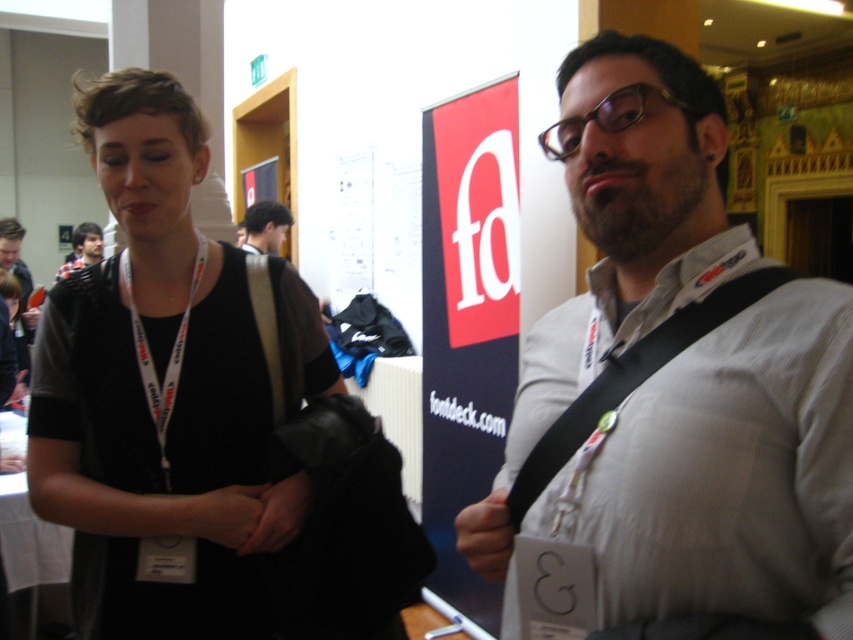
Question: Considering the real-world distances, which object is farthest from the dark blue shirt at upper left?

Choices:
 (A) white fabric lanyard at center
 (B) black matte vest at left
 (C) black fabric lanyard at center
 (D) dark brown hair at upper center

Answer: (C)

Question: Among these points, which one is farthest from the camera?

Choices:
 (A) (450, 173)
 (B) (241, 424)
 (C) (662, 506)
 (D) (254, 212)

Answer: (D)

Question: Which of the following is the farthest from the observer?

Choices:
 (A) (654, 515)
 (B) (183, 122)
 (C) (267, 214)

Answer: (C)

Question: Does black fabric lanyard at center have a smaller size compared to white fabric lanyard at center?

Choices:
 (A) yes
 (B) no

Answer: (B)

Question: Can you confirm if red fabric banner at center is thinner than dark brown hair at upper center?

Choices:
 (A) no
 (B) yes

Answer: (A)

Question: Is the position of black matte vest at left less distant than that of dark brown hair at upper center?

Choices:
 (A) no
 (B) yes

Answer: (B)